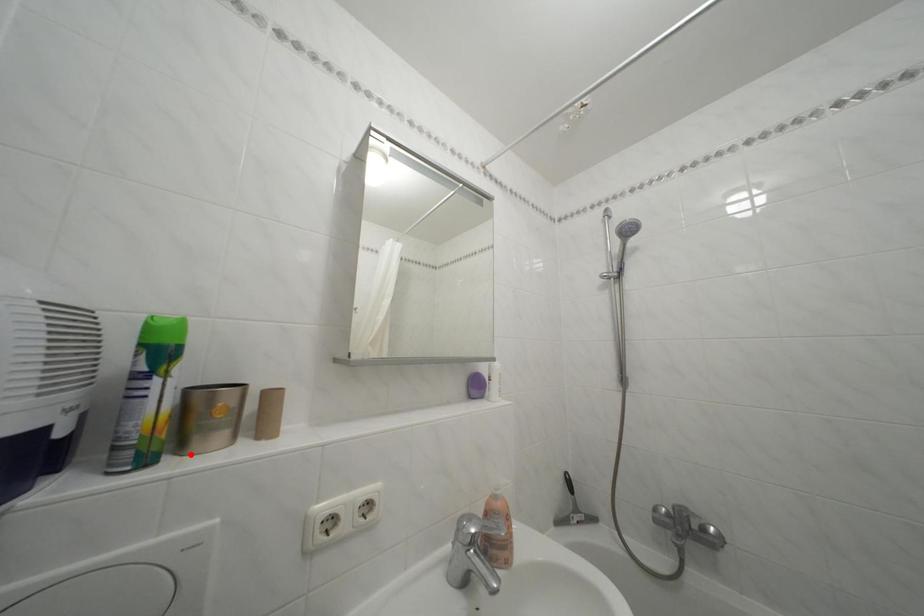
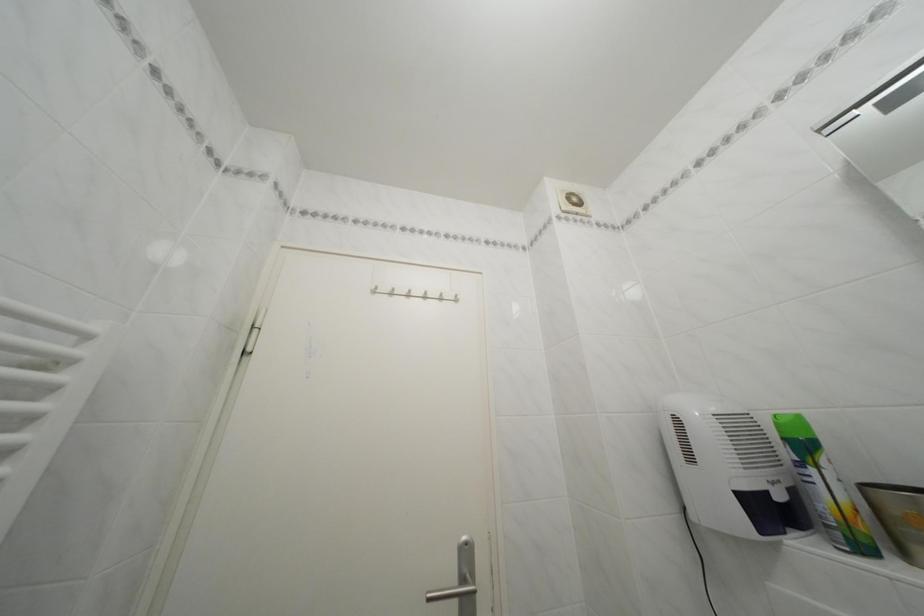
In the second image, find the point that corresponds to the highlighted location in the first image.

(915, 561)